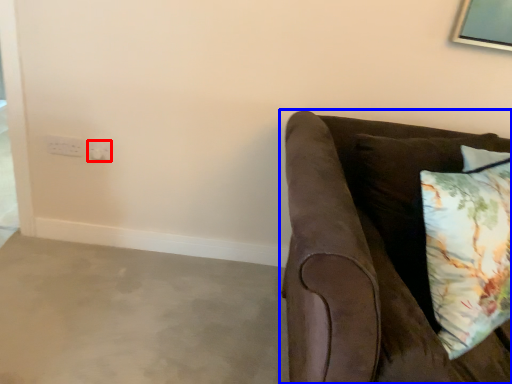
Question: Which of the following is the closest to the observer, electric outlet (highlighted by a red box) or studio couch (highlighted by a blue box)?

Choices:
 (A) electric outlet
 (B) studio couch

Answer: (B)